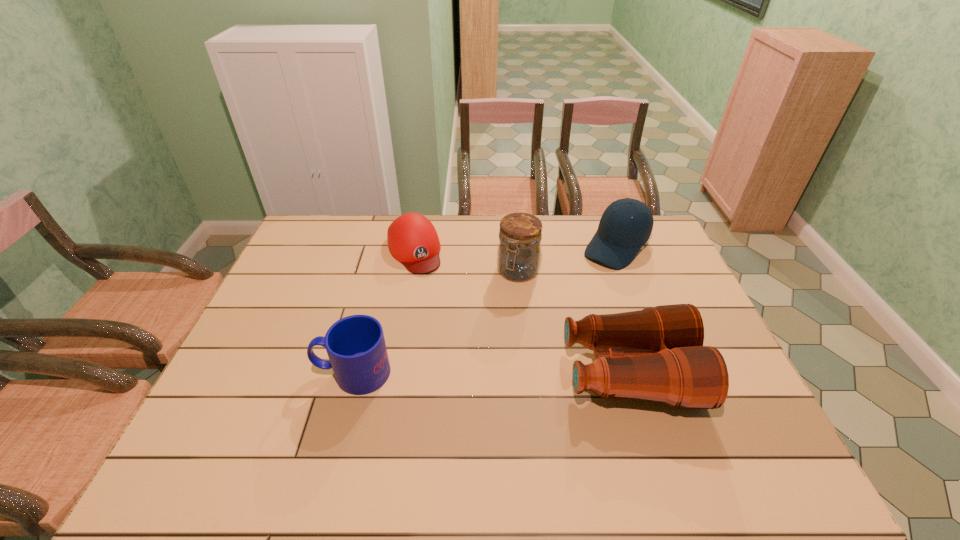
What are the coordinates of `unoccupied position between the jar and the right baseball cap` in the screenshot? It's located at (567, 259).

Identify the location of vacant area that lies between the mug and the left baseball cap. This screenshot has width=960, height=540. (383, 312).

Locate an element on the screen. free spot between the tallest object and the taller baseball cap is located at coordinates (567, 259).

Find the location of a particular element. The width and height of the screenshot is (960, 540). free space between the mug and the taller baseball cap is located at coordinates (485, 310).

Locate an element on the screen. The width and height of the screenshot is (960, 540). empty space that is in between the binoculars and the right baseball cap is located at coordinates (623, 310).

Find the location of a particular element. blank region between the jar and the taller baseball cap is located at coordinates (567, 259).

Locate an element on the screen. Image resolution: width=960 pixels, height=540 pixels. vacant space in between the binoculars and the left baseball cap is located at coordinates (521, 312).

This screenshot has height=540, width=960. In order to click on vacant space that's between the taller baseball cap and the mug in this screenshot , I will do `click(485, 310)`.

You are a GUI agent. You are given a task and a screenshot of the screen. Output one action in this format:
    pyautogui.click(x=<x>, y=<y>)
    Task: Click on the object that is the fourth closest one to the taller baseball cap
    
    Given the screenshot: What is the action you would take?
    pyautogui.click(x=356, y=347)

Locate which object is the fourth closest to the taller baseball cap. Please provide its 2D coordinates. Your answer should be formatted as a tuple, i.e. [(x, y)], where the tuple contains the x and y coordinates of a point satisfying the conditions above.

[(356, 347)]